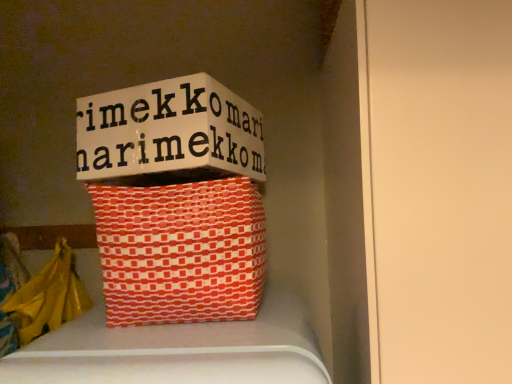
Question: In terms of width, does orange woven basket at center look wider or thinner when compared to white cardboard box at upper center?

Choices:
 (A) thin
 (B) wide

Answer: (B)

Question: Based on their sizes in the image, would you say orange woven basket at center is bigger or smaller than white cardboard box at upper center?

Choices:
 (A) small
 (B) big

Answer: (B)

Question: Considering the real-world distances, which object is closest to the white cardboard box at upper center?

Choices:
 (A) yellow plastic bag at lower left
 (B) orange woven basket at center

Answer: (B)

Question: Estimate the real-world distances between objects in this image. Which object is closer to the yellow plastic bag at lower left?

Choices:
 (A) orange woven basket at center
 (B) white cardboard box at upper center

Answer: (A)